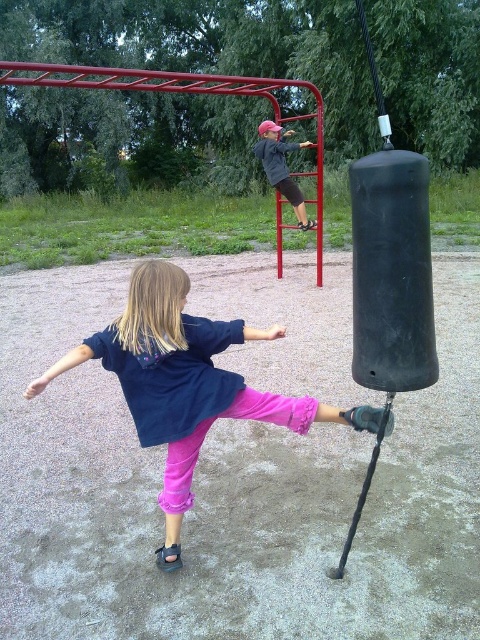
Which of these two, pink fabric pants at lower center or matte black jacket at upper center, stands taller?

Standing taller between the two is matte black jacket at upper center.

Describe the element at coordinates (189, 384) in the screenshot. I see `pink fabric pants at lower center` at that location.

Where is `pink fabric pants at lower center`? The image size is (480, 640). pink fabric pants at lower center is located at coordinates (189, 384).